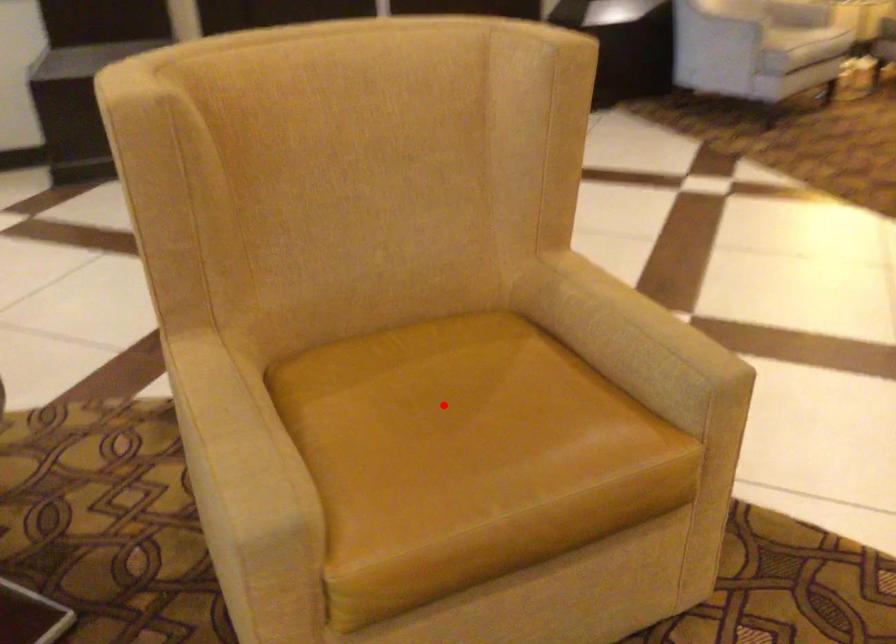
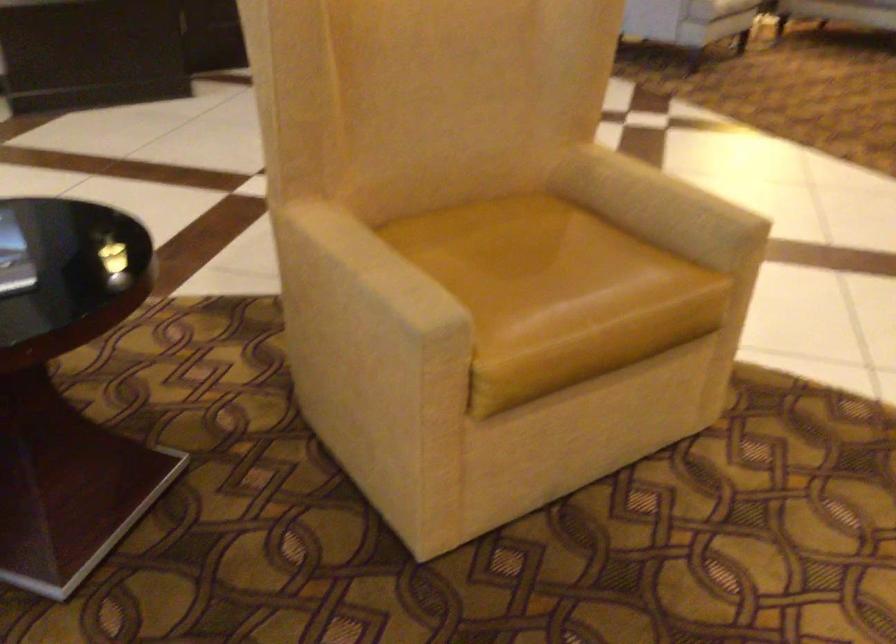
Question: I am providing you with two images of the same scene from different viewpoints. Image1 has a red point marked. In image2, the corresponding 3D location appears at what relative position? Reply with the corresponding letter.

Choices:
 (A) Closer
 (B) Farther

Answer: (B)